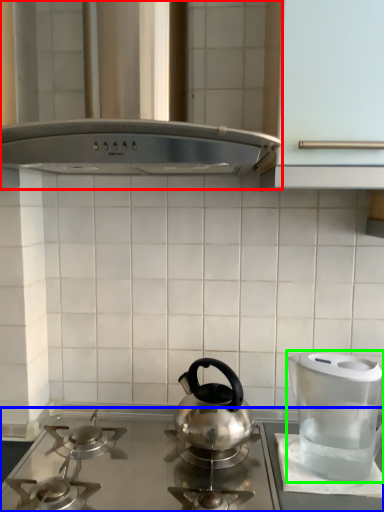
Question: Which object is positioned farthest from vent (highlighted by a red box)? Select from gas stove (highlighted by a blue box) and kitchen appliance (highlighted by a green box).

Choices:
 (A) gas stove
 (B) kitchen appliance

Answer: (A)